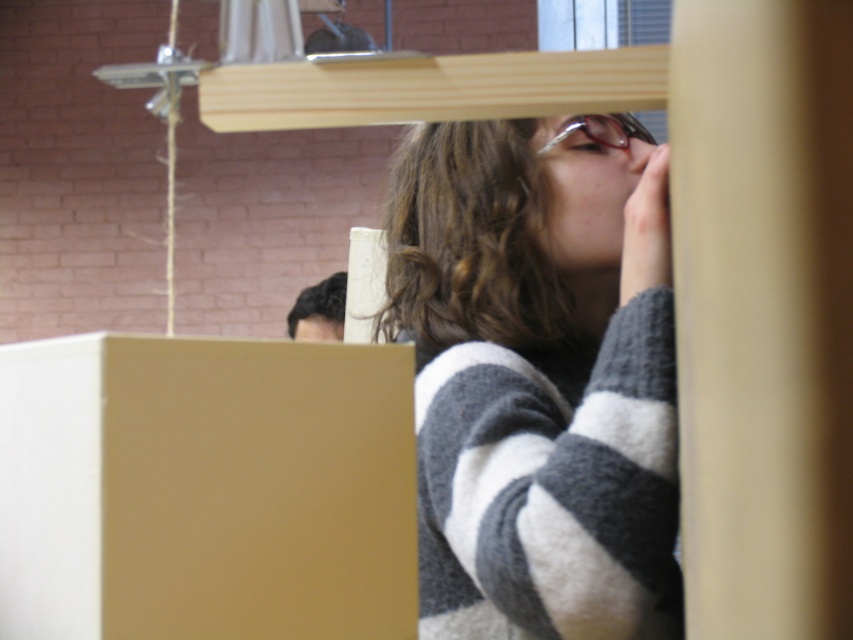
Question: Does striped sweater at upper right lie in front of matte cardboard box at lower left?

Choices:
 (A) yes
 (B) no

Answer: (B)

Question: Which object appears farthest from the camera in this image?

Choices:
 (A) striped sweater at upper right
 (B) matte cardboard box at lower left
 (C) clear plastic goggles at upper center

Answer: (C)

Question: Is striped sweater at upper right thinner than clear plastic goggles at upper center?

Choices:
 (A) yes
 (B) no

Answer: (B)

Question: Which of these objects is positioned farthest from the striped sweater at upper right?

Choices:
 (A) clear plastic goggles at upper center
 (B) matte cardboard box at lower left

Answer: (B)

Question: Does striped sweater at upper right have a greater width compared to clear plastic goggles at upper center?

Choices:
 (A) no
 (B) yes

Answer: (B)

Question: Which object appears farthest from the camera in this image?

Choices:
 (A) clear plastic goggles at upper center
 (B) matte cardboard box at lower left
 (C) striped sweater at upper right

Answer: (A)